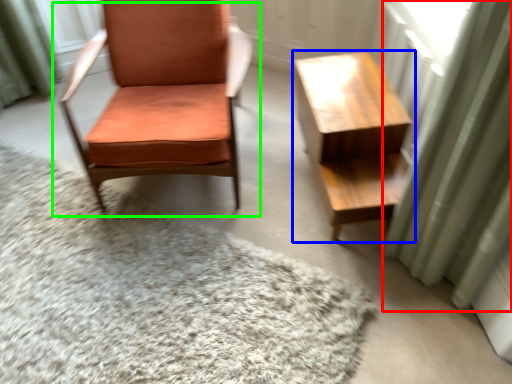
Question: Based on their relative distances, which object is nearer to curtain (highlighted by a red box)? Choose from table (highlighted by a blue box) and chair (highlighted by a green box).

Choices:
 (A) table
 (B) chair

Answer: (A)